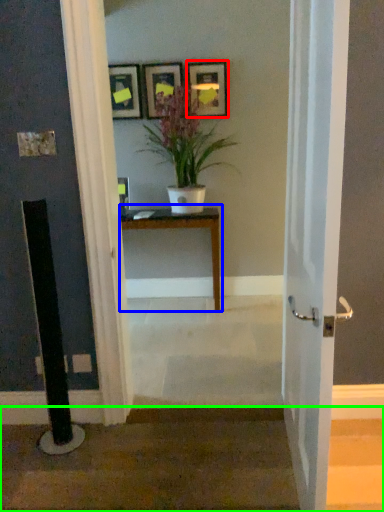
Question: Which object is positioned farthest from picture frame (highlighted by a red box)? Select from table (highlighted by a blue box) and stairwell (highlighted by a green box).

Choices:
 (A) table
 (B) stairwell

Answer: (B)